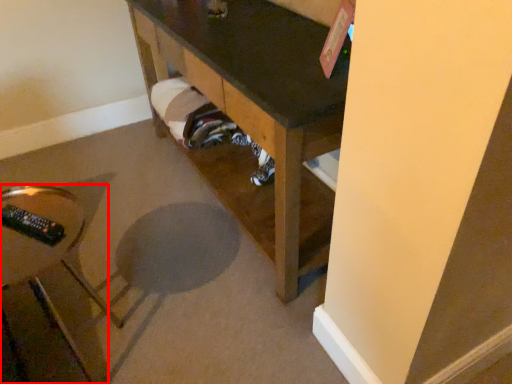
Question: Considering the relative positions of furniture (annotated by the red box) and furniture in the image provided, where is furniture (annotated by the red box) located with respect to the staircase?

Choices:
 (A) right
 (B) left

Answer: (B)